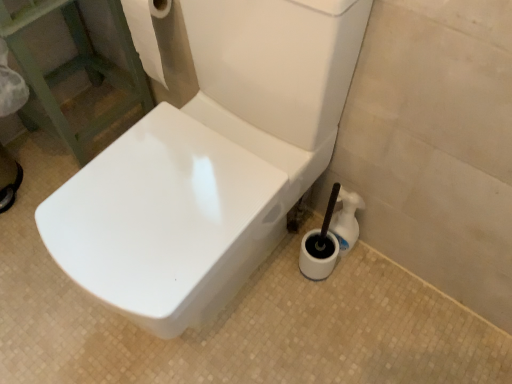
The width and height of the screenshot is (512, 384). Identify the location of vacant area to the right of white glossy toilet brush at lower right. (385, 268).